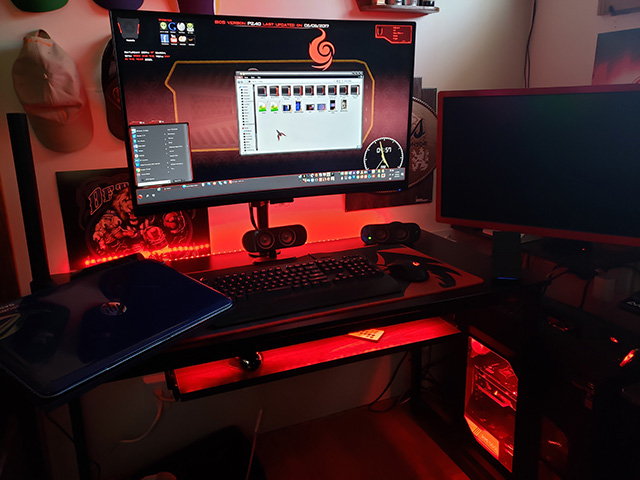
Find the location of a particular element. This screenshot has height=480, width=640. poster is located at coordinates (114, 220), (422, 105), (609, 56), (614, 1).